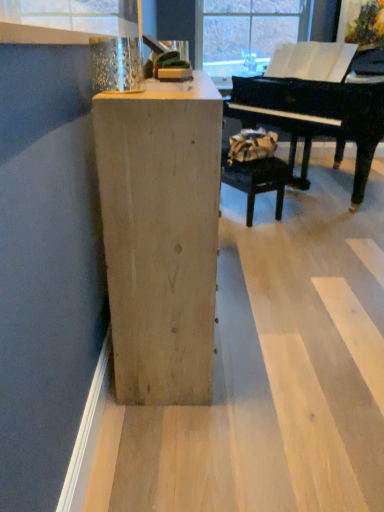
Question: Can you confirm if black polished piano at upper right is wider than metallic glass at upper left?

Choices:
 (A) no
 (B) yes

Answer: (B)

Question: Is black polished piano at upper right oriented towards metallic glass at upper left?

Choices:
 (A) yes
 (B) no

Answer: (A)

Question: Does black polished piano at upper right have a lesser width compared to metallic glass at upper left?

Choices:
 (A) yes
 (B) no

Answer: (B)

Question: Is black polished piano at upper right to the left of metallic glass at upper left from the viewer's perspective?

Choices:
 (A) no
 (B) yes

Answer: (A)

Question: Is the depth of black polished piano at upper right less than that of metallic glass at upper left?

Choices:
 (A) no
 (B) yes

Answer: (A)

Question: Is black polished piano at upper right at the right side of metallic glass at upper left?

Choices:
 (A) no
 (B) yes

Answer: (B)

Question: Is natural wood cabinet at center not within leather-like brown bag at center?

Choices:
 (A) no
 (B) yes

Answer: (B)

Question: From the image's perspective, is natural wood cabinet at center located beneath leather-like brown bag at center?

Choices:
 (A) yes
 (B) no

Answer: (A)

Question: Could you tell me if natural wood cabinet at center is facing leather-like brown bag at center?

Choices:
 (A) no
 (B) yes

Answer: (A)

Question: Is natural wood cabinet at center positioned behind leather-like brown bag at center?

Choices:
 (A) no
 (B) yes

Answer: (A)

Question: Considering the relative positions of natural wood cabinet at center and leather-like brown bag at center in the image provided, is natural wood cabinet at center in front of leather-like brown bag at center?

Choices:
 (A) no
 (B) yes

Answer: (B)

Question: From a real-world perspective, is natural wood cabinet at center below leather-like brown bag at center?

Choices:
 (A) yes
 (B) no

Answer: (B)

Question: Is metallic glass at upper left with natural wood cabinet at center?

Choices:
 (A) no
 (B) yes

Answer: (A)